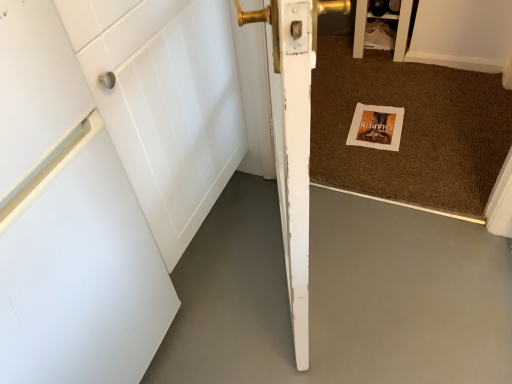
Identify the location of spots to the right of white matte door at center. The height and width of the screenshot is (384, 512). (394, 263).